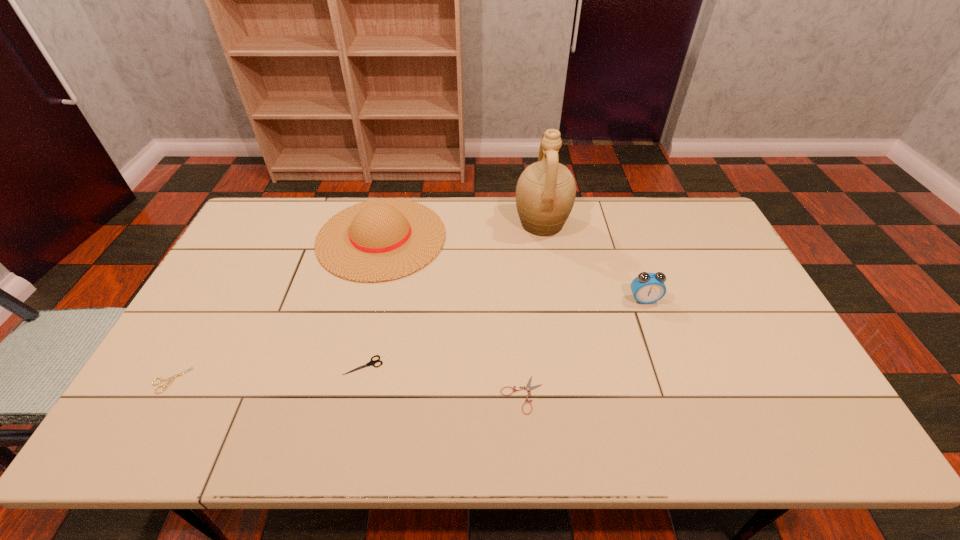
Where is `vacant point located between the fourth tallest object and the bonnet`? The height and width of the screenshot is (540, 960). vacant point located between the fourth tallest object and the bonnet is located at coordinates (372, 301).

Identify the location of empty location between the second tallest shears and the pitcher. (356, 302).

Where is `vacant area that lies between the tallest object and the rightmost object`? The width and height of the screenshot is (960, 540). vacant area that lies between the tallest object and the rightmost object is located at coordinates (593, 261).

You are a GUI agent. You are given a task and a screenshot of the screen. Output one action in this format:
    pyautogui.click(x=<x>, y=<y>)
    Task: Click on the empty space that is in between the rightmost shears and the fifth tallest object
    
    Given the screenshot: What is the action you would take?
    pyautogui.click(x=347, y=388)

At what (x,y) coordinates should I click in order to perform the action: click on free space between the alarm clock and the shortest shears. Please return your answer as a coordinate pair (x, y). Looking at the image, I should click on (583, 347).

Find the location of a particular element. free space between the fourth tallest object and the second shortest object is located at coordinates (267, 373).

Find the location of a particular element. The height and width of the screenshot is (540, 960). vacant area that lies between the shortest shears and the bonnet is located at coordinates (452, 316).

Image resolution: width=960 pixels, height=540 pixels. What are the coordinates of `object that is the fourth closest to the bonnet` in the screenshot? It's located at (528, 388).

Where is `the fifth closest object to the shortest object`? the fifth closest object to the shortest object is located at coordinates (171, 379).

Identify which shears is the nearest to the bonnet. Please provide its 2D coordinates. Your answer should be formatted as a tuple, i.e. [(x, y)], where the tuple contains the x and y coordinates of a point satisfying the conditions above.

[(372, 362)]